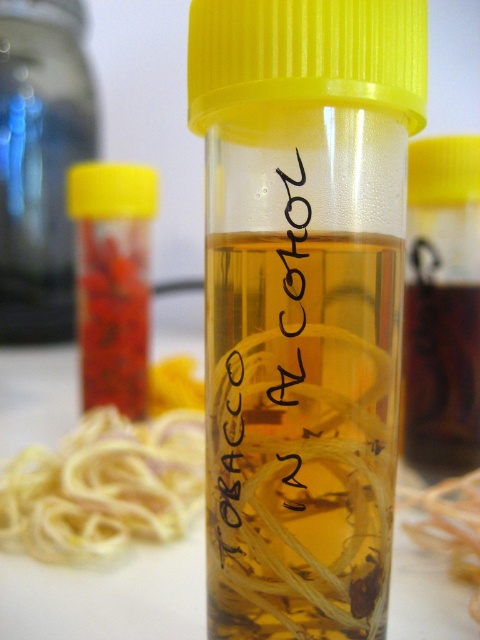
You are organizing items on a shelf and need to place the translucent plastic bottle at left and the yellow rubber band at lower left. According to their positions in the image, which item should you place first if you want to maintain the same spatial arrangement?

The translucent plastic bottle at left should be placed first because it is positioned to the left of the yellow rubber band at lower left, so placing it first maintains the correct leftward placement.

You are organizing items on a shelf and see the translucent plastic bottle at left and the yellow rubber band at lower left. Which item is positioned higher on the shelf?

The translucent plastic bottle at left is positioned higher on the shelf than the yellow rubber band at lower left because it is above it.